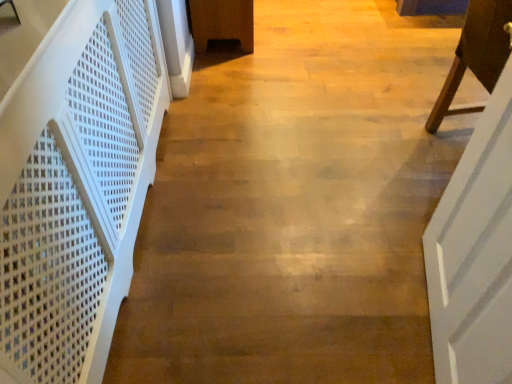
You are a GUI agent. You are given a task and a screenshot of the screen. Output one action in this format:
    pyautogui.click(x=<x>, y=<y>)
    Task: Click on the brown wooden chair at right
    Image resolution: width=512 pixels, height=384 pixels.
    Given the screenshot: What is the action you would take?
    pyautogui.click(x=475, y=55)

Locate an element on the screen. The width and height of the screenshot is (512, 384). door above the white plastic stairwell at left (from a real-world perspective) is located at coordinates (476, 245).

Looking at this image, is white wooden door at right bigger than white plastic stairwell at left?

No.

In the image, is white wooden door at right on the left side or the right side of white plastic stairwell at left?

white wooden door at right is positioned on white plastic stairwell at left's right side.

From the image's perspective, who appears lower, white wooden door at right or white plastic stairwell at left?

white wooden door at right is shown below in the image.

Find the location of a particular element. furniture behind the white wooden door at right is located at coordinates pyautogui.click(x=475, y=55).

Who is bigger, brown wooden chair at right or white wooden door at right?

brown wooden chair at right is bigger.

From their relative heights in the image, would you say brown wooden chair at right is taller or shorter than white wooden door at right?

brown wooden chair at right is shorter than white wooden door at right.

From the image's perspective, which one is positioned lower, white plastic stairwell at left or white wooden door at right?

white wooden door at right is shown below in the image.

Looking at this image, could you tell me if white plastic stairwell at left is turned towards white wooden door at right?

Yes, white plastic stairwell at left is aimed at white wooden door at right.

Can you confirm if white plastic stairwell at left is wider than white wooden door at right?

Indeed, white plastic stairwell at left has a greater width compared to white wooden door at right.

Does white plastic stairwell at left touch white wooden door at right?

No, white plastic stairwell at left is not making contact with white wooden door at right.

How much distance is there between white wooden door at right and brown wooden chair at right?

white wooden door at right and brown wooden chair at right are 26.37 inches apart from each other.

From the image's perspective, which one is positioned higher, white wooden door at right or brown wooden chair at right?

brown wooden chair at right.

From the picture: Considering the positions of objects white wooden door at right and brown wooden chair at right in the image provided, who is more to the left, white wooden door at right or brown wooden chair at right?

From the viewer's perspective, white wooden door at right appears more on the left side.

Which is more to the right, brown wooden chair at right or white plastic stairwell at left?

brown wooden chair at right.

In the image, there is a white plastic stairwell at left. Find the location of `furniture above it (from the image's perspective)`. furniture above it (from the image's perspective) is located at coordinates (475, 55).

Is brown wooden chair at right not inside white plastic stairwell at left?

Yes, brown wooden chair at right is not within white plastic stairwell at left.

From the image's perspective, relative to white plastic stairwell at left, is brown wooden chair at right above or below?

Based on their image positions, brown wooden chair at right is located above white plastic stairwell at left.

Is white plastic stairwell at left located outside brown wooden chair at right?

That's correct, white plastic stairwell at left is outside of brown wooden chair at right.

From the image's perspective, which one is positioned higher, white plastic stairwell at left or brown wooden chair at right?

brown wooden chair at right.

Considering the positions of objects white plastic stairwell at left and brown wooden chair at right in the image provided, who is in front, white plastic stairwell at left or brown wooden chair at right?

white plastic stairwell at left is in front.

Consider the image. Is white plastic stairwell at left touching brown wooden chair at right?

They are not placed beside each other.

Locate an element on the screen. stairwell above the white wooden door at right (from the image's perspective) is located at coordinates (76, 186).

Locate an element on the screen. This screenshot has width=512, height=384. door on the left of brown wooden chair at right is located at coordinates (476, 245).

Considering their positions, is brown wooden chair at right positioned further to white plastic stairwell at left than white wooden door at right?

Among the two, brown wooden chair at right is located further to white plastic stairwell at left.

Which object lies further to the anchor point brown wooden chair at right, white plastic stairwell at left or white wooden door at right?

white plastic stairwell at left is further to brown wooden chair at right.

When comparing their distances from white wooden door at right, does white plastic stairwell at left or brown wooden chair at right seem closer?

brown wooden chair at right is closer to white wooden door at right.

Based on their spatial positions, is white wooden door at right or white plastic stairwell at left further from brown wooden chair at right?

white plastic stairwell at left lies further to brown wooden chair at right than the other object.

Looking at the image, which one is located further to white wooden door at right, brown wooden chair at right or white plastic stairwell at left?

Among the two, white plastic stairwell at left is located further to white wooden door at right.

Which object lies nearer to the anchor point white plastic stairwell at left, white wooden door at right or brown wooden chair at right?

white wooden door at right lies closer to white plastic stairwell at left than the other object.

Where is `door located between white plastic stairwell at left and brown wooden chair at right in the left-right direction`? Image resolution: width=512 pixels, height=384 pixels. door located between white plastic stairwell at left and brown wooden chair at right in the left-right direction is located at coordinates (476, 245).